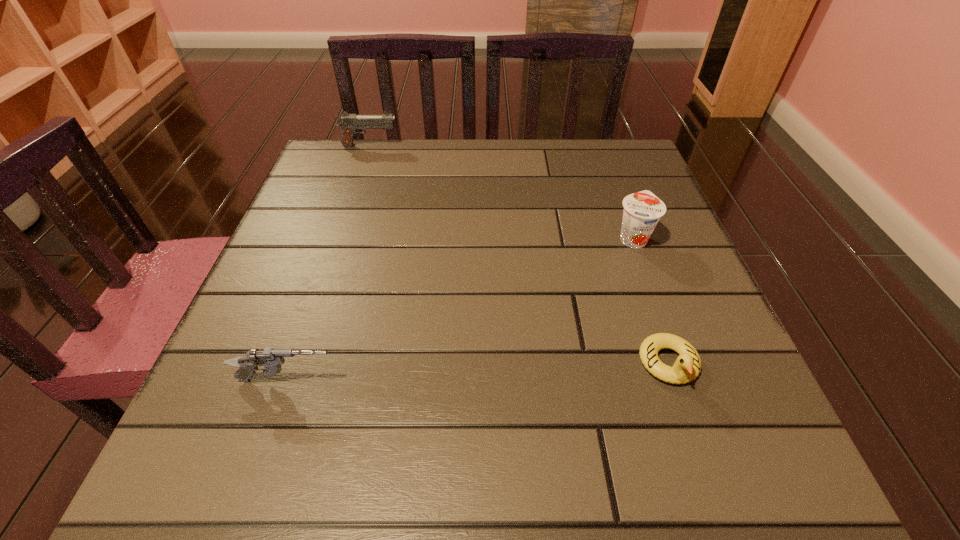
Find the location of `yogurt at the right edge`. yogurt at the right edge is located at coordinates (642, 210).

Locate an element on the screen. The image size is (960, 540). duckling positioned at the right edge is located at coordinates (687, 366).

The height and width of the screenshot is (540, 960). Find the location of `object that is at the far left corner`. object that is at the far left corner is located at coordinates (349, 123).

Find the location of a particular element. This screenshot has height=540, width=960. blank area at the far edge is located at coordinates (478, 192).

Identify the location of vacant point at the near edge. (596, 454).

In the image, there is a desktop. Identify the location of blank space at the left edge. This screenshot has height=540, width=960. (238, 386).

In the image, there is a desktop. Identify the location of vacant area at the right edge. Image resolution: width=960 pixels, height=540 pixels. (652, 329).

Locate an element on the screen. The width and height of the screenshot is (960, 540). vacant space at the far left corner of the desktop is located at coordinates coord(333,178).

In the image, there is a desktop. Where is `vacant region at the far right corner`? vacant region at the far right corner is located at coordinates (581, 151).

Where is `free space between the yogurt and the farthest object`? The image size is (960, 540). free space between the yogurt and the farthest object is located at coordinates (501, 192).